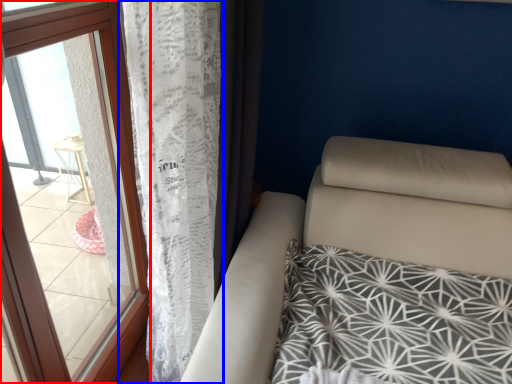
Question: Which of the following is the closest to the observer, window (highlighted by a red box) or curtain (highlighted by a blue box)?

Choices:
 (A) window
 (B) curtain

Answer: (A)